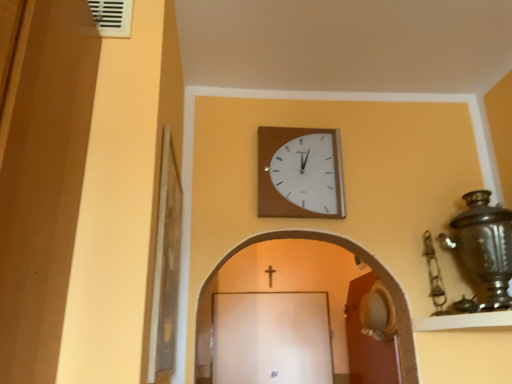
Question: Is gold metallic crucifix at center located within wooden wall clock at upper center?

Choices:
 (A) yes
 (B) no

Answer: (B)

Question: From the image's perspective, is wooden wall clock at upper center beneath gold metallic crucifix at center?

Choices:
 (A) no
 (B) yes

Answer: (A)

Question: Considering the relative sizes of wooden wall clock at upper center and gold metallic crucifix at center in the image provided, is wooden wall clock at upper center wider than gold metallic crucifix at center?

Choices:
 (A) yes
 (B) no

Answer: (A)

Question: Can we say wooden wall clock at upper center lies outside gold metallic crucifix at center?

Choices:
 (A) yes
 (B) no

Answer: (A)

Question: Is wooden wall clock at upper center with gold metallic crucifix at center?

Choices:
 (A) yes
 (B) no

Answer: (B)

Question: Is brown wooden door at lower right inside or outside of gold metallic crucifix at center?

Choices:
 (A) inside
 (B) outside

Answer: (B)

Question: Considering the positions of brown wooden door at lower right and gold metallic crucifix at center in the image, is brown wooden door at lower right taller or shorter than gold metallic crucifix at center?

Choices:
 (A) tall
 (B) short

Answer: (A)

Question: From the image's perspective, is brown wooden door at lower right above or below gold metallic crucifix at center?

Choices:
 (A) below
 (B) above

Answer: (A)

Question: Is brown wooden door at lower right bigger or smaller than gold metallic crucifix at center?

Choices:
 (A) big
 (B) small

Answer: (A)

Question: In the image, is gold metallic crucifix at center on the left side or the right side of brown wooden door at lower right?

Choices:
 (A) right
 (B) left

Answer: (B)

Question: From their relative heights in the image, would you say gold metallic crucifix at center is taller or shorter than brown wooden door at lower right?

Choices:
 (A) tall
 (B) short

Answer: (B)

Question: In terms of size, does gold metallic crucifix at center appear bigger or smaller than brown wooden door at lower right?

Choices:
 (A) small
 (B) big

Answer: (A)

Question: Considering their positions, is gold metallic crucifix at center located in front of or behind brown wooden door at lower right?

Choices:
 (A) behind
 (B) front

Answer: (A)

Question: In terms of size, does brown wooden door at lower right appear bigger or smaller than white plastic vent at upper left?

Choices:
 (A) small
 (B) big

Answer: (B)

Question: Looking at their shapes, would you say brown wooden door at lower right is wider or thinner than white plastic vent at upper left?

Choices:
 (A) thin
 (B) wide

Answer: (B)